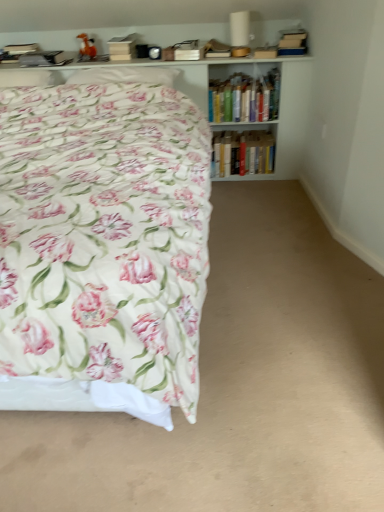
Question: Should I look upward or downward to see hardcover books at center, marked as the first book in a bottom-to-top arrangement?

Choices:
 (A) down
 (B) up

Answer: (B)

Question: From a real-world perspective, is white glossy bookcase at upper center located beneath white soft pillow at upper left, the 2th pillow when ordered from left to right?

Choices:
 (A) no
 (B) yes

Answer: (B)

Question: Is white glossy bookcase at upper center at the right side of white soft pillow at upper left, the 2th pillow when ordered from left to right?

Choices:
 (A) yes
 (B) no

Answer: (A)

Question: Can white soft pillow at upper left, the 1th pillow from the right, be found inside white glossy bookcase at upper center?

Choices:
 (A) no
 (B) yes

Answer: (A)

Question: From a real-world perspective, is white glossy bookcase at upper center over white soft pillow at upper left, the 2th pillow when ordered from left to right?

Choices:
 (A) yes
 (B) no

Answer: (B)

Question: Does white glossy bookcase at upper center have a greater height compared to white soft pillow at upper left, the 1th pillow from the right?

Choices:
 (A) no
 (B) yes

Answer: (B)

Question: From the image's perspective, would you say white glossy bookcase at upper center is positioned over white soft pillow at upper left, the 1th pillow from the right?

Choices:
 (A) no
 (B) yes

Answer: (A)

Question: Is white soft pillow at upper left, the 2th pillow when ordered from left to right, not within white soft pillow at upper left, the second pillow in the right-to-left sequence?

Choices:
 (A) no
 (B) yes

Answer: (B)

Question: Is white soft pillow at upper left, the 2th pillow when ordered from left to right, far away from white soft pillow at upper left, which ranks as the 1th pillow in left-to-right order?

Choices:
 (A) no
 (B) yes

Answer: (A)

Question: Is white soft pillow at upper left, the 2th pillow when ordered from left to right, looking in the opposite direction of white soft pillow at upper left, which ranks as the 1th pillow in left-to-right order?

Choices:
 (A) no
 (B) yes

Answer: (A)

Question: Does white soft pillow at upper left, the 2th pillow when ordered from left to right, have a lesser height compared to white soft pillow at upper left, which ranks as the 1th pillow in left-to-right order?

Choices:
 (A) yes
 (B) no

Answer: (A)

Question: Considering the relative positions of white soft pillow at upper left, the 1th pillow from the right, and white soft pillow at upper left, the second pillow in the right-to-left sequence, in the image provided, is white soft pillow at upper left, the 1th pillow from the right, to the left of white soft pillow at upper left, the second pillow in the right-to-left sequence, from the viewer's perspective?

Choices:
 (A) no
 (B) yes

Answer: (A)

Question: Does white soft pillow at upper left, the 2th pillow when ordered from left to right, have a greater height compared to white soft pillow at upper left, which ranks as the 1th pillow in left-to-right order?

Choices:
 (A) no
 (B) yes

Answer: (A)

Question: Is hardcover books at upper right, placed as the second book when sorted from bottom to top, smaller than floral fabric bed at left?

Choices:
 (A) no
 (B) yes

Answer: (B)